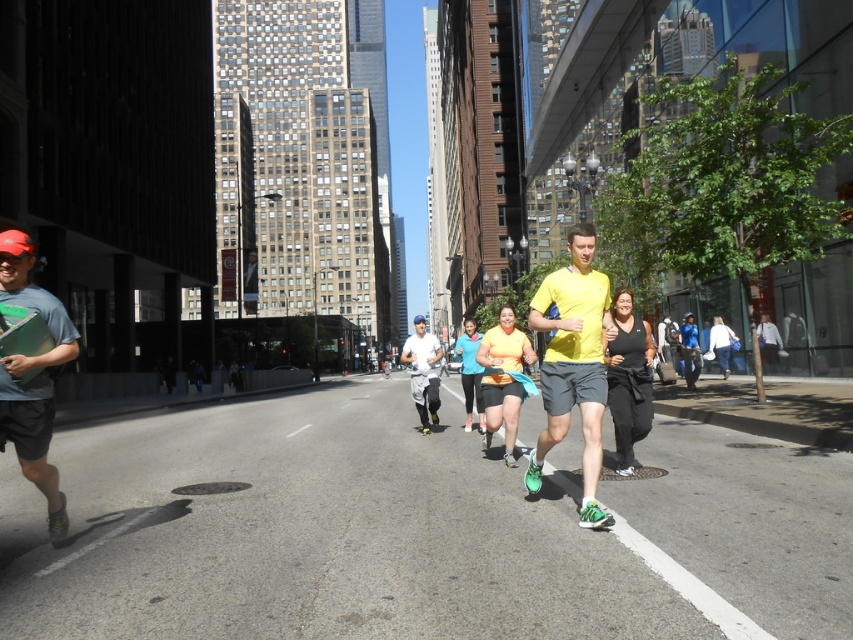
You are a photographer trying to capture a runner in the scene. The matte gray shirt at left and the white matte running shoes at center are both in your viewfinder. Which object should you focus on to ensure it takes up more of the photo?

You should focus on the white matte running shoes at center because it occupies more space than the matte gray shirt at left.

You are a photographer standing at the corner of the street. You want to capture a photo of the yellow matte shirt at center. Based on the coordinates provided, where should you aim your camera?

The yellow matte shirt at center is located at coordinates point [573,364], so you should aim your camera towards that point to capture it.